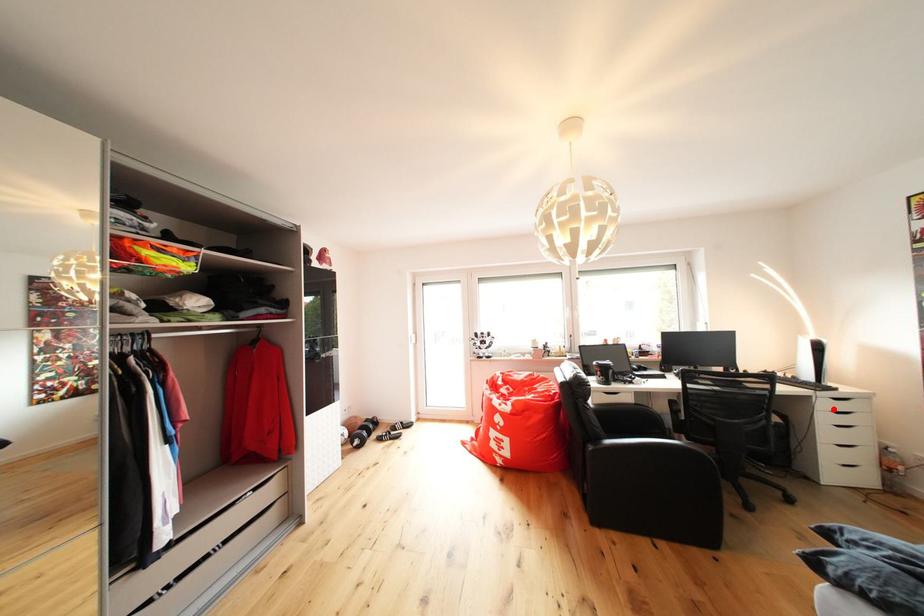
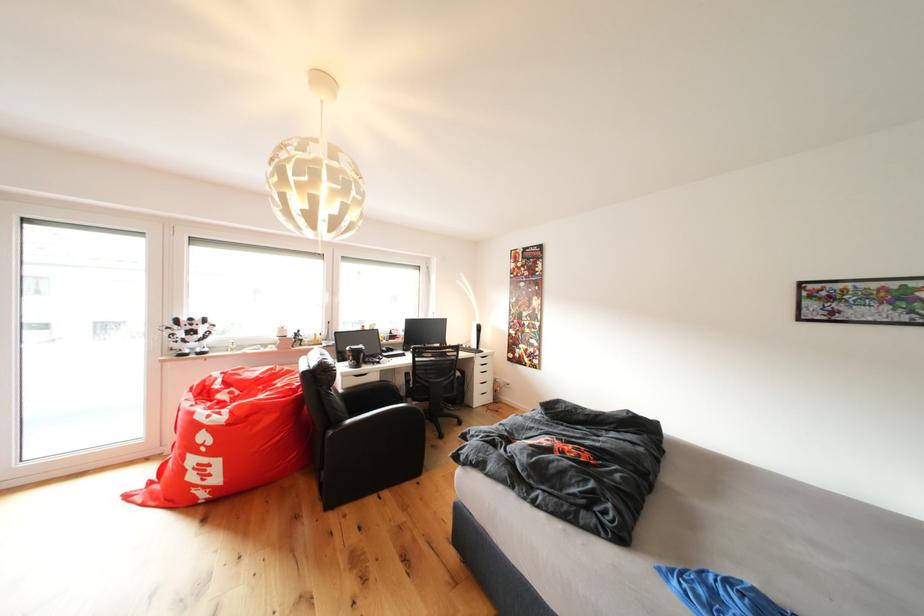
Question: I am providing you with two images of the same scene from different viewpoints. A red point is shown in image1. For the corresponding object point in image2, is it positioned nearer or farther from the camera?

Choices:
 (A) Nearer
 (B) Farther

Answer: (B)